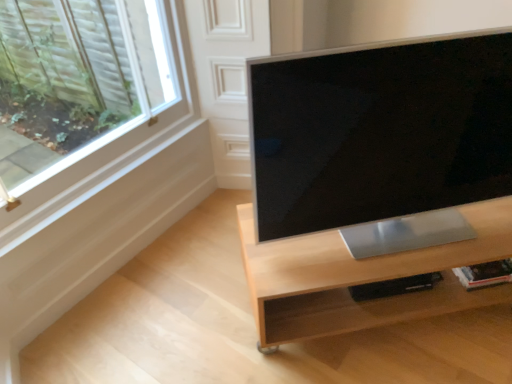
In order to click on free space above light wood/finish tv stand at center (from a real-world perspective) in this screenshot , I will do `click(394, 244)`.